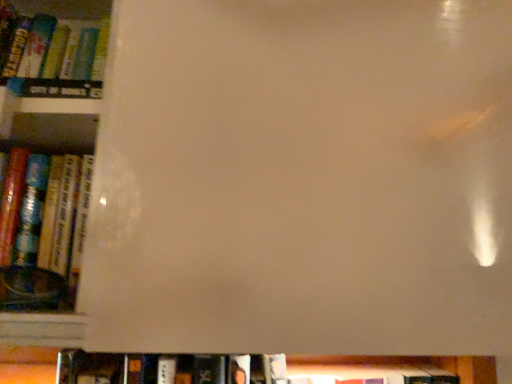
Where is `hardcover book at left, the 2th book from the back`? The width and height of the screenshot is (512, 384). hardcover book at left, the 2th book from the back is located at coordinates (48, 235).

Describe the element at coordinates (48, 235) in the screenshot. Image resolution: width=512 pixels, height=384 pixels. I see `hardcover book at left, acting as the first book starting from the front` at that location.

At what (x,y) coordinates should I click in order to perform the action: click on hardcover book at lower center, which appears as the 2th book when viewed from the front. Please return your answer as a coordinate pair (x, y). The image size is (512, 384). Looking at the image, I should click on (169, 369).

This screenshot has height=384, width=512. Describe the element at coordinates (169, 369) in the screenshot. I see `hardcover book at lower center, which appears as the 2th book when viewed from the front` at that location.

At what (x,y) coordinates should I click in order to perform the action: click on hardcover book at left, acting as the 2th book starting from the bottom. Please return your answer as a coordinate pair (x, y). Looking at the image, I should click on pos(48,235).

Is hardcover book at left, acting as the 2th book starting from the bottom, to the right of hardcover book at lower center, the first book viewed from the back, from the viewer's perspective?

No, hardcover book at left, acting as the 2th book starting from the bottom, is not to the right of hardcover book at lower center, the first book viewed from the back.

Considering the positions of objects hardcover book at left, acting as the 2th book starting from the bottom, and hardcover book at lower center, the first book viewed from the back, in the image provided, who is behind, hardcover book at left, acting as the 2th book starting from the bottom, or hardcover book at lower center, the first book viewed from the back,?

hardcover book at lower center, the first book viewed from the back, is further away from the camera.

Which is farther from the camera, (x=62, y=293) or (x=144, y=357)?

The point (x=144, y=357) is farther from the camera.

From the image's perspective, relative to hardcover book at lower center, the 2th book positioned from the top, is hardcover book at left, acting as the first book starting from the front, above or below?

Clearly, from the image's perspective, hardcover book at left, acting as the first book starting from the front, is above hardcover book at lower center, the 2th book positioned from the top.

From a real-world perspective, which is physically below, hardcover book at left, the 2th book from the back, or hardcover book at lower center, the 1th book in the bottom-to-top sequence?

hardcover book at lower center, the 1th book in the bottom-to-top sequence.

Based on the photo, considering the sizes of objects hardcover book at left, acting as the first book starting from the front, and hardcover book at lower center, the 1th book in the bottom-to-top sequence, in the image provided, who is wider, hardcover book at left, acting as the first book starting from the front, or hardcover book at lower center, the 1th book in the bottom-to-top sequence,?

With larger width is hardcover book at lower center, the 1th book in the bottom-to-top sequence.

Can you confirm if hardcover book at left, the 2th book from the back, is shorter than hardcover book at lower center, the 2th book positioned from the top?

No.

Considering the sizes of objects hardcover book at left, the 2th book from the back, and hardcover book at lower center, the first book viewed from the back, in the image provided, who is smaller, hardcover book at left, the 2th book from the back, or hardcover book at lower center, the first book viewed from the back,?

Smaller between the two is hardcover book at left, the 2th book from the back.

Would you say hardcover book at left, the 2th book from the back, is inside or outside hardcover book at lower center, which appears as the 2th book when viewed from the front?

The correct answer is: outside.

Are hardcover book at left, acting as the 2th book starting from the bottom, and hardcover book at lower center, which appears as the 2th book when viewed from the front, beside each other?

They are not placed beside each other.

Could you tell me if hardcover book at left, the 2th book from the back, is turned towards hardcover book at lower center, which appears as the 2th book when viewed from the front?

No, hardcover book at left, the 2th book from the back, does not turn towards hardcover book at lower center, which appears as the 2th book when viewed from the front.

The height and width of the screenshot is (384, 512). I want to click on book lying on the left of hardcover book at lower center, which appears as the 2th book when viewed from the front, so click(x=48, y=235).

Which object is positioned more to the right, hardcover book at lower center, the 1th book in the bottom-to-top sequence, or hardcover book at left, the 2th book from the back?

hardcover book at lower center, the 1th book in the bottom-to-top sequence.

Which object is closer to the camera, hardcover book at lower center, the 1th book in the bottom-to-top sequence, or hardcover book at left, acting as the first book starting from the front?

Positioned in front is hardcover book at left, acting as the first book starting from the front.

Does point (149, 380) appear closer or farther from the camera than point (69, 299)?

Point (149, 380).

From the image's perspective, which one is positioned higher, hardcover book at lower center, the 2th book positioned from the top, or hardcover book at left, acting as the 2th book starting from the bottom?

hardcover book at left, acting as the 2th book starting from the bottom, from the image's perspective.

From a real-world perspective, is hardcover book at lower center, which appears as the 2th book when viewed from the front, below hardcover book at left, acting as the first book starting from the front?

Correct, in the physical world, hardcover book at lower center, which appears as the 2th book when viewed from the front, is lower than hardcover book at left, acting as the first book starting from the front.

Which object is thinner, hardcover book at lower center, which appears as the 2th book when viewed from the front, or hardcover book at left, acting as the 2th book starting from the bottom?

hardcover book at left, acting as the 2th book starting from the bottom.

In terms of height, does hardcover book at lower center, the 2th book positioned from the top, look taller or shorter compared to hardcover book at left, which is the first book in top-to-bottom order?

Considering their sizes, hardcover book at lower center, the 2th book positioned from the top, has less height than hardcover book at left, which is the first book in top-to-bottom order.

Can you confirm if hardcover book at lower center, the 2th book positioned from the top, is smaller than hardcover book at left, which is the first book in top-to-bottom order?

No.

Is hardcover book at left, acting as the 2th book starting from the bottom, completely or partially inside hardcover book at lower center, the first book viewed from the back?

Actually, hardcover book at left, acting as the 2th book starting from the bottom, is outside hardcover book at lower center, the first book viewed from the back.

Are hardcover book at lower center, the 1th book in the bottom-to-top sequence, and hardcover book at left, which is the first book in top-to-bottom order, beside each other?

No, hardcover book at lower center, the 1th book in the bottom-to-top sequence, is not beside hardcover book at left, which is the first book in top-to-bottom order.

Is hardcover book at lower center, the 1th book in the bottom-to-top sequence, aimed at hardcover book at left, the 2th book from the back?

No, hardcover book at lower center, the 1th book in the bottom-to-top sequence, is not facing towards hardcover book at left, the 2th book from the back.

Can you tell me how much hardcover book at lower center, which appears as the 2th book when viewed from the front, and hardcover book at left, which is the first book in top-to-bottom order, differ in facing direction?

The facing directions of hardcover book at lower center, which appears as the 2th book when viewed from the front, and hardcover book at left, which is the first book in top-to-bottom order, are 0.00184 degrees apart.

The height and width of the screenshot is (384, 512). What are the coordinates of `book lying behind the hardcover book at left, acting as the 2th book starting from the bottom` in the screenshot? It's located at (169, 369).

Image resolution: width=512 pixels, height=384 pixels. In order to click on book in front of the hardcover book at lower center, the first book viewed from the back in this screenshot , I will do click(x=48, y=235).

In the image, there is a hardcover book at left, the 2th book from the back. Identify the location of book below it (from the image's perspective). (169, 369).